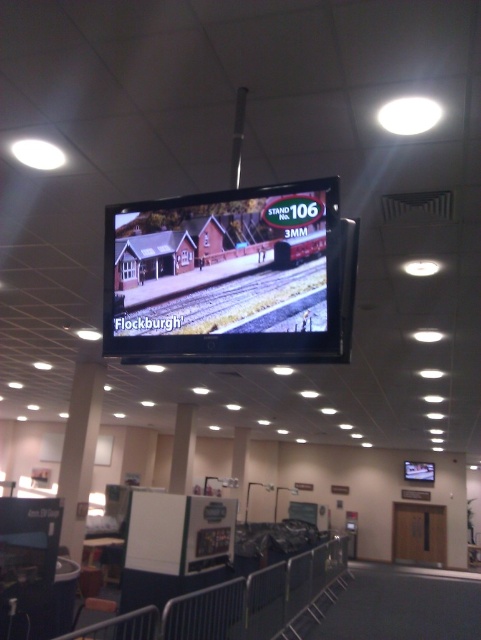
You are at the exhibition hall and want to locate the Flockburgh model railway exhibit. You see the matte black screen at center and the brown gravel train track at center. Which one is positioned higher in the scene?

The matte black screen at center is above the brown gravel train track at center, so the screen is higher.

You are at the convention center and want to find the Flockburgh exhibit. You see the matte black screen at center and the brown gravel train track at center. Which one is closer to the left side of the convention center?

The matte black screen at center is to the left of brown gravel train track at center, so the matte black screen at center is closer to the left side of the convention center.

You are at the exhibition hall and want to take a photo of both the matte black screen at center and the brown gravel train track at center. Which object should you focus on first if you want to capture both in a single frame without moving your camera?

You should focus on the matte black screen at center first because it is larger and will require more attention in the frame. Since it is larger than the brown gravel train track at center, positioning the camera to include both would naturally prioritize the larger object to ensure it fits properly while the smaller track can be accommodated within the same frame.